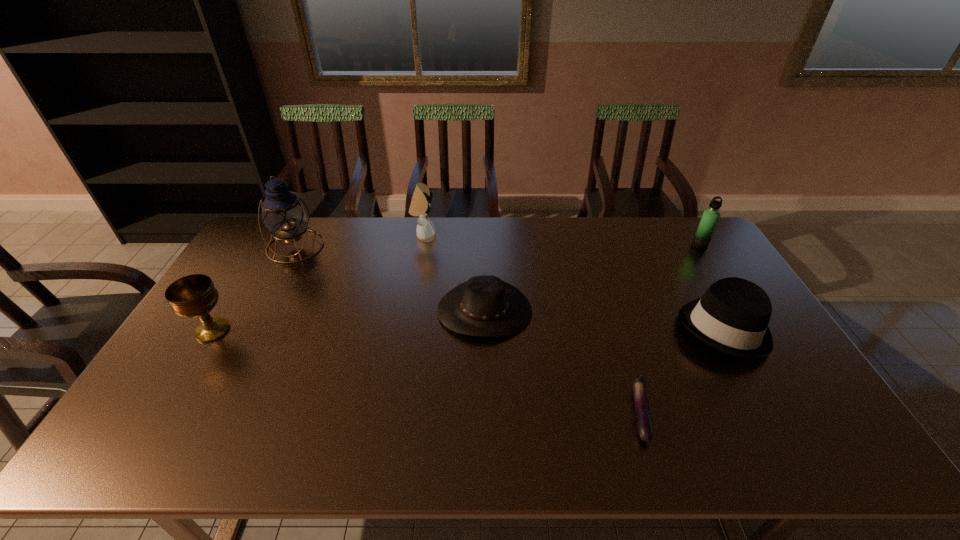
This screenshot has height=540, width=960. Identify the location of vacant area at the near left corner. (106, 461).

Where is `free space between the eggplant and the thermos bottle`? This screenshot has width=960, height=540. free space between the eggplant and the thermos bottle is located at coordinates (670, 329).

Locate an element on the screen. unoccupied area between the third object from left to right and the chalice is located at coordinates (318, 283).

Locate an element on the screen. Image resolution: width=960 pixels, height=540 pixels. free space between the doll and the sixth tallest object is located at coordinates (454, 273).

Find the location of a particular element. This screenshot has height=540, width=960. vacant space that is in between the lantern and the thermos bottle is located at coordinates (497, 246).

The height and width of the screenshot is (540, 960). I want to click on free space between the third object from left to right and the third object from right to left, so point(532,324).

You are a GUI agent. You are given a task and a screenshot of the screen. Output one action in this format:
    pyautogui.click(x=<x>, y=<y>)
    Task: Click on the empty location between the chalice and the doll
    The image size is (960, 540).
    Given the screenshot: What is the action you would take?
    pyautogui.click(x=318, y=283)

The height and width of the screenshot is (540, 960). Identify the location of free space between the third object from left to right and the shortest object. (532, 324).

Find the location of a particular element. free spot between the chalice and the fifth object from left to right is located at coordinates (426, 372).

Where is `free area in between the chalice and the fifth object from left to right`? free area in between the chalice and the fifth object from left to right is located at coordinates (426, 372).